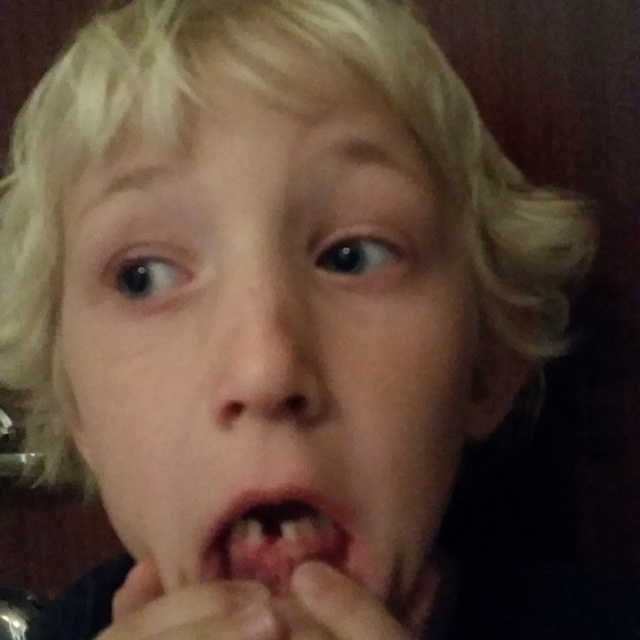
Question: Can you confirm if pink flesh at center is wider than smooth skin hand at lower center?

Choices:
 (A) no
 (B) yes

Answer: (A)

Question: Is pink flesh at center bigger than smooth skin hand at lower center?

Choices:
 (A) yes
 (B) no

Answer: (B)

Question: Is pink flesh at center above smooth skin hand at lower center?

Choices:
 (A) no
 (B) yes

Answer: (B)

Question: Which of the following is the farthest from the observer?

Choices:
 (A) (131, 580)
 (B) (321, 515)

Answer: (B)

Question: Estimate the real-world distances between objects in this image. Which object is closer to the smooth skin face at center?

Choices:
 (A) pink flesh at center
 (B) smooth skin hand at lower center

Answer: (A)

Question: Among these points, which one is farthest from the camera?

Choices:
 (A) pos(145,230)
 (B) pos(156,609)

Answer: (A)